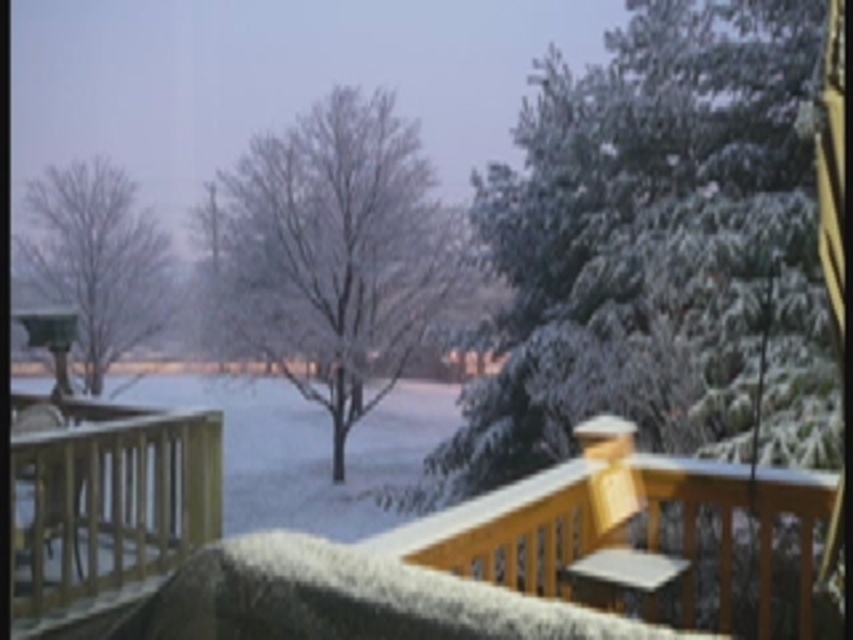
Question: From the image, what is the correct spatial relationship of wooden porch at center in relation to bare wood tree at left?

Choices:
 (A) right
 (B) left

Answer: (A)

Question: Which object is closer to the camera taking this photo?

Choices:
 (A) wooden porch at center
 (B) bare wood tree at left

Answer: (A)

Question: Is snow-covered tree at center bigger than bare wood tree at left?

Choices:
 (A) yes
 (B) no

Answer: (A)

Question: Is wooden porch at center smaller than snow-covered tree at center?

Choices:
 (A) no
 (B) yes

Answer: (B)

Question: Estimate the real-world distances between objects in this image. Which object is farther from the snow-covered tree at center?

Choices:
 (A) wooden porch at center
 (B) bare wood tree at left
 (C) snow-covered evergreen at upper right

Answer: (A)

Question: Which object appears farthest from the camera in this image?

Choices:
 (A) snow-covered evergreen at upper right
 (B) wooden porch at center
 (C) snow-covered tree at center
 (D) bare wood tree at left

Answer: (D)